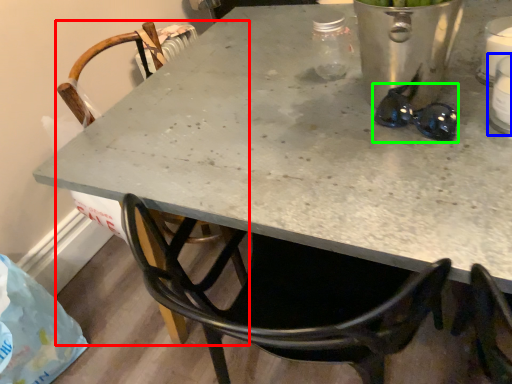
Question: Which object is the farthest from chair (highlighted by a red box)? Choose among these: appliance (highlighted by a blue box) or glasses (highlighted by a green box).

Choices:
 (A) appliance
 (B) glasses

Answer: (A)